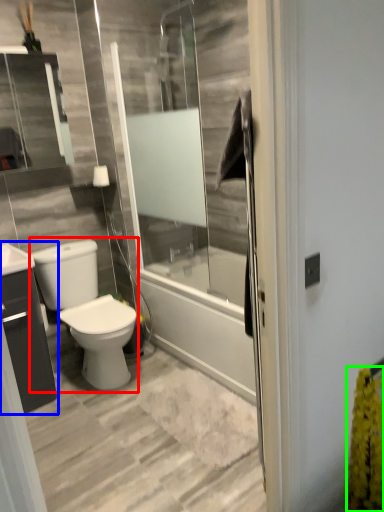
Question: Estimate the real-world distances between objects in this image. Which object is farther from gray (highlighted by a red box), bathroom cabinet (highlighted by a blue box) or flower (highlighted by a green box)?

Choices:
 (A) bathroom cabinet
 (B) flower

Answer: (B)